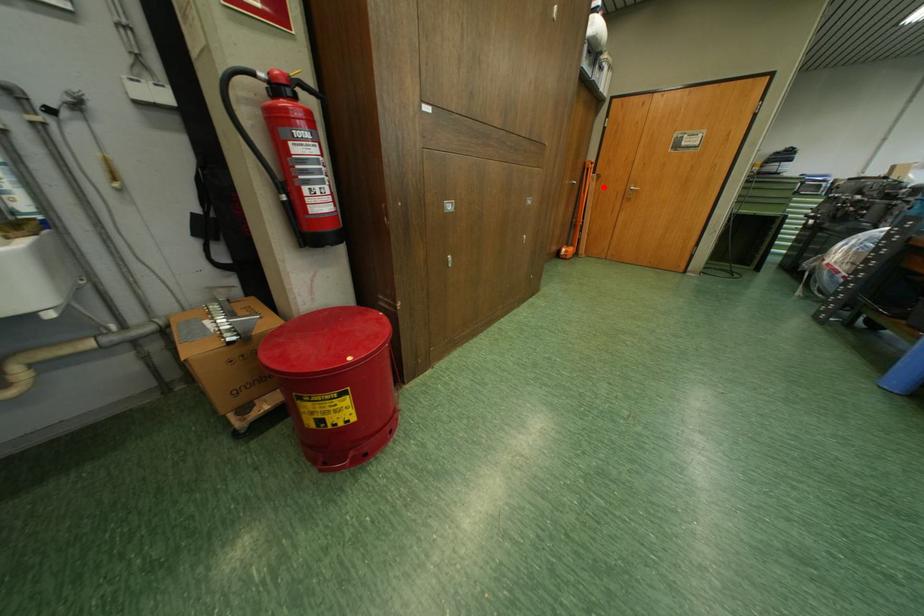
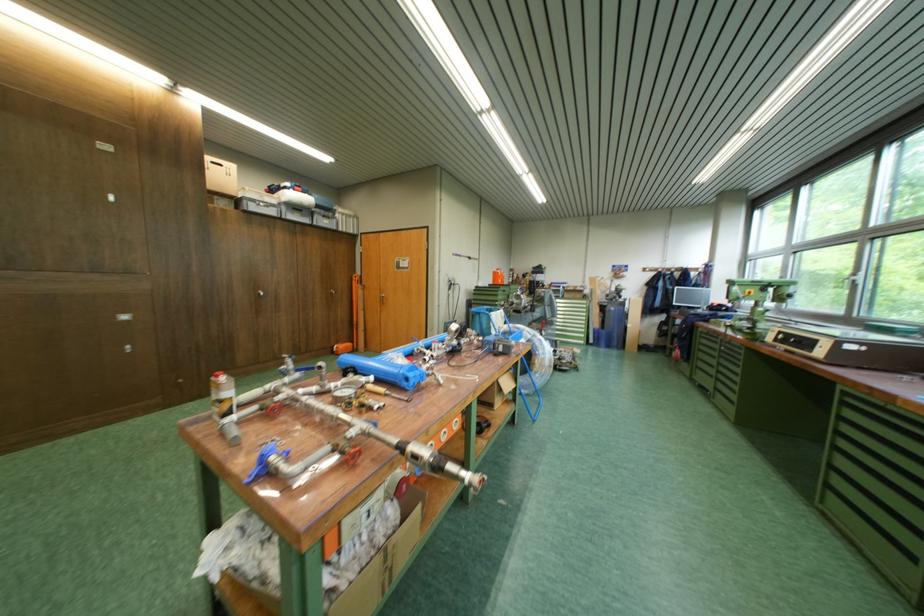
Question: I am providing you with two images of the same scene from different viewpoints. In image1, a red point is highlighted. Considering the same 3D point in image2, which of the following is correct?

Choices:
 (A) It is closer
 (B) It is farther

Answer: (B)